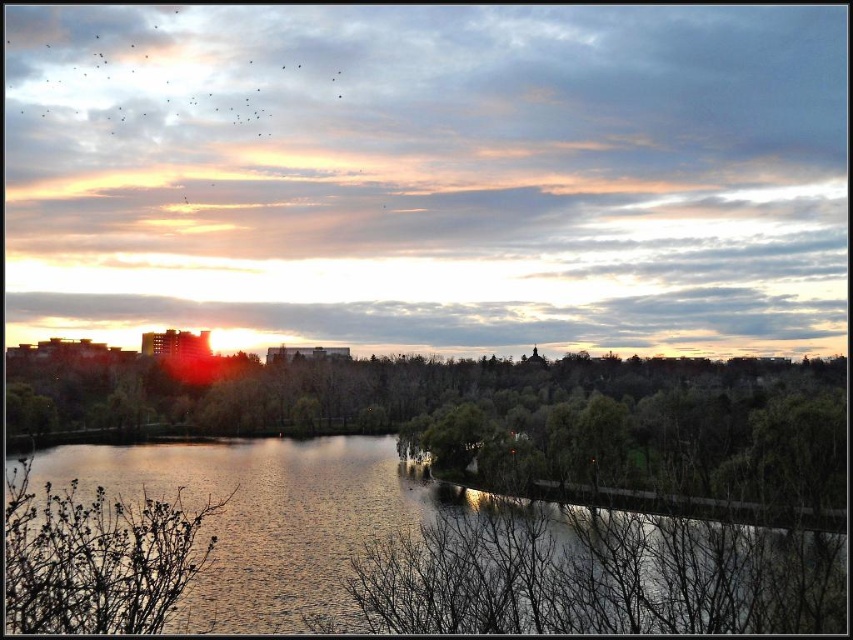
You are standing at the edge of the water and want to take a photo of both the green leafy trees at center and the glistening water at center. Which object will appear closer to the camera in your photo?

The green leafy trees at center will appear closer to the camera in your photo because they are positioned further to the viewer than the glistening water at center.

You are standing at the edge of the lake and see the green leafy trees at center and the glistening water at center. Which object is positioned higher in the scene?

The green leafy trees at center are positioned higher than the glistening water at center in the scene.